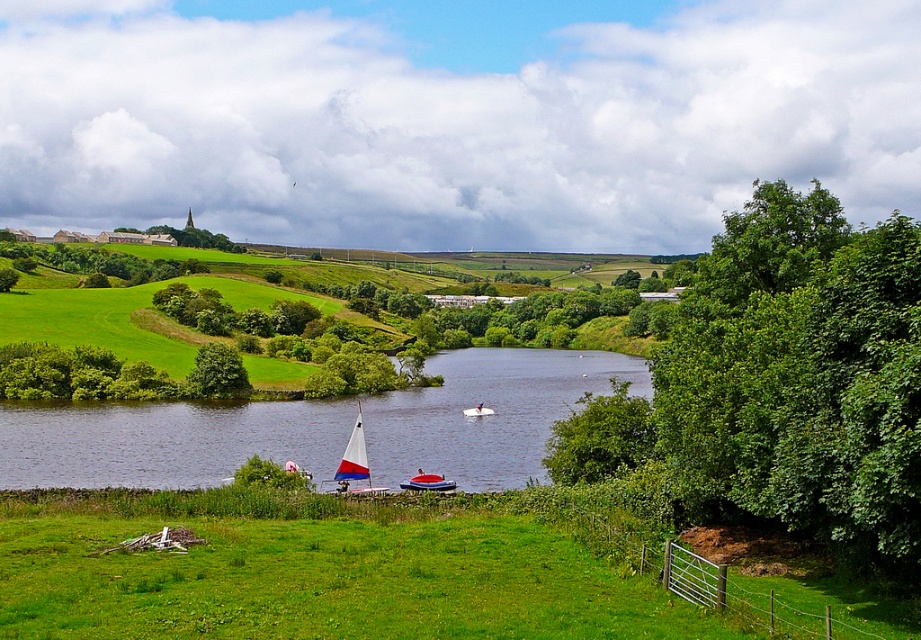
Question: Can you confirm if green leafy tree at center-left is positioned above white sailboat at center?

Choices:
 (A) yes
 (B) no

Answer: (A)

Question: Is green leafy tree at right further to camera compared to green grassy river at center?

Choices:
 (A) yes
 (B) no

Answer: (B)

Question: Based on their relative distances, which object is farther from the white plastic boat at center?

Choices:
 (A) green leafy tree at right
 (B) white sailboat at center
 (C) blue plastic boat at center
 (D) green leafy tree at center-left

Answer: (A)

Question: Which object is the farthest from the green leafy tree at center-left?

Choices:
 (A) white sailboat at center
 (B) white plastic boat at center
 (C) blue plastic boat at center

Answer: (C)

Question: Can you confirm if white sailboat at center is wider than white plastic boat at center?

Choices:
 (A) no
 (B) yes

Answer: (B)

Question: Based on their relative distances, which object is farther from the white plastic boat at center?

Choices:
 (A) white sailboat at center
 (B) green grassy river at center
 (C) blue plastic boat at center

Answer: (C)